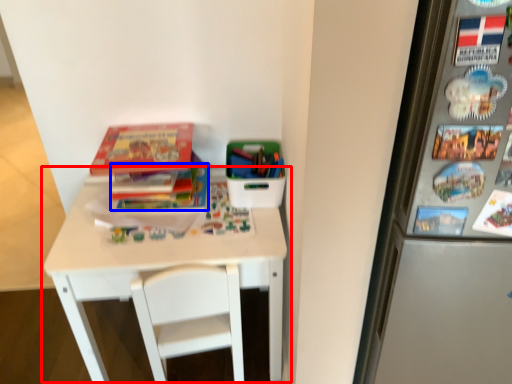
Question: Which object is further to the camera taking this photo, table (highlighted by a red box) or book (highlighted by a blue box)?

Choices:
 (A) table
 (B) book

Answer: (B)